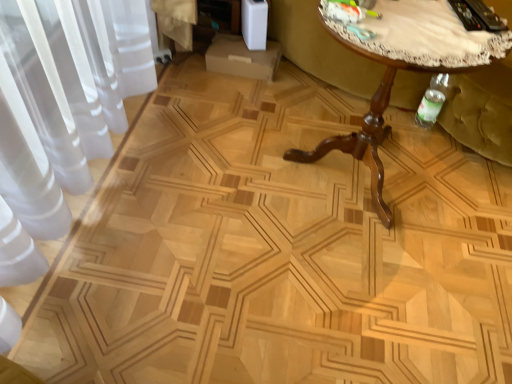
Question: From a real-world perspective, is green fabric swivel chair at right positioned above or below brown wooden table at center?

Choices:
 (A) below
 (B) above

Answer: (A)

Question: Does point (470, 97) appear closer or farther from the camera than point (377, 105)?

Choices:
 (A) farther
 (B) closer

Answer: (A)

Question: In the image, is green fabric swivel chair at right on the left side or the right side of brown wooden table at center?

Choices:
 (A) left
 (B) right

Answer: (B)

Question: Is brown wooden table at center in front of or behind green fabric swivel chair at right in the image?

Choices:
 (A) behind
 (B) front

Answer: (B)

Question: Is brown wooden table at center bigger or smaller than green fabric swivel chair at right?

Choices:
 (A) small
 (B) big

Answer: (B)

Question: In terms of width, does brown wooden table at center look wider or thinner when compared to green fabric swivel chair at right?

Choices:
 (A) thin
 (B) wide

Answer: (A)

Question: From a real-world perspective, relative to green fabric swivel chair at right, is brown wooden table at center vertically above or below?

Choices:
 (A) above
 (B) below

Answer: (A)